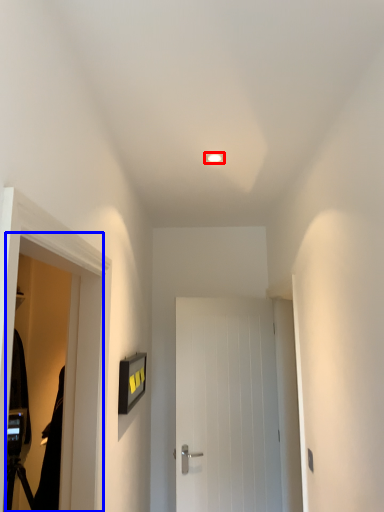
Question: Among these objects, which one is nearest to the camera, lighting (highlighted by a red box) or screen door (highlighted by a blue box)?

Choices:
 (A) lighting
 (B) screen door

Answer: (B)